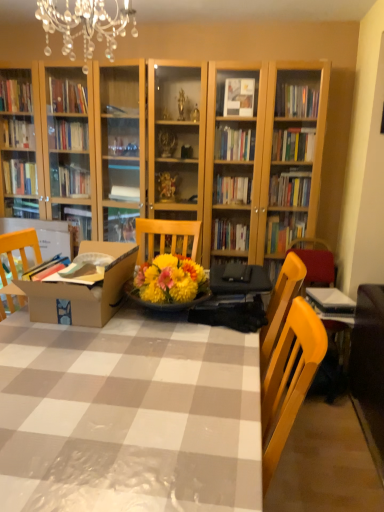
Find the location of a particular element. vacant area on top of wooden table at center (from a real-world perspective) is located at coordinates (130, 368).